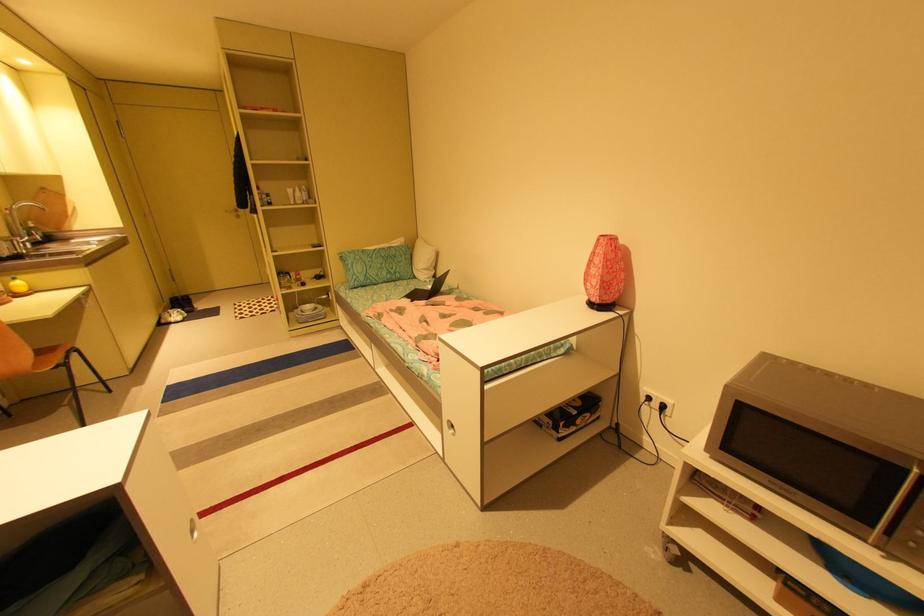
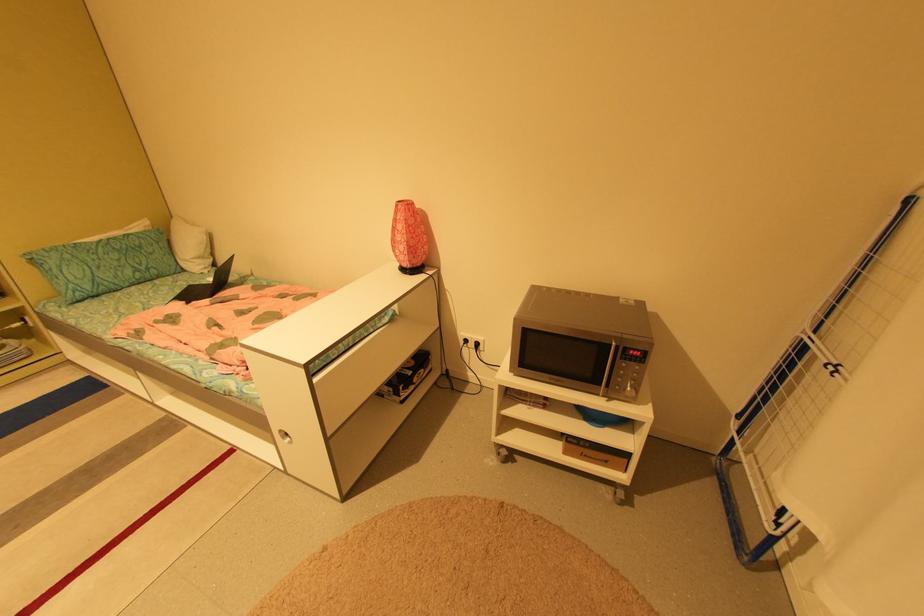
Where in the second image is the point corresponding to point (420, 278) from the first image?

(190, 270)